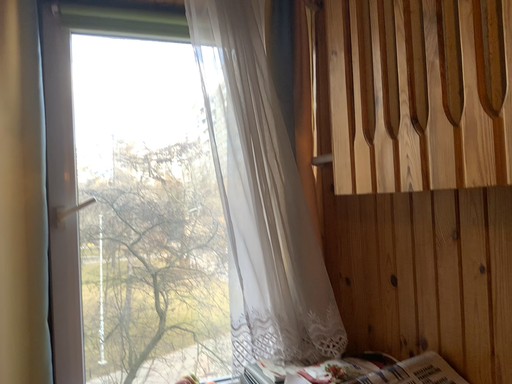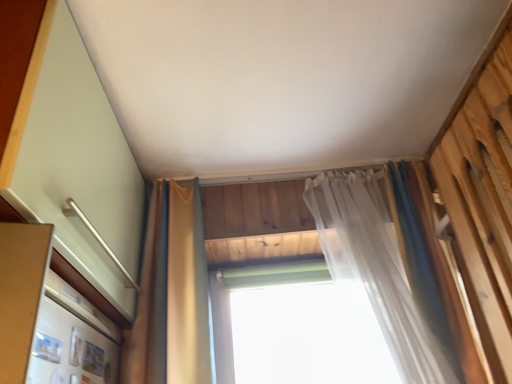
Question: How did the camera likely rotate when shooting the video?

Choices:
 (A) rotated left
 (B) rotated right

Answer: (A)